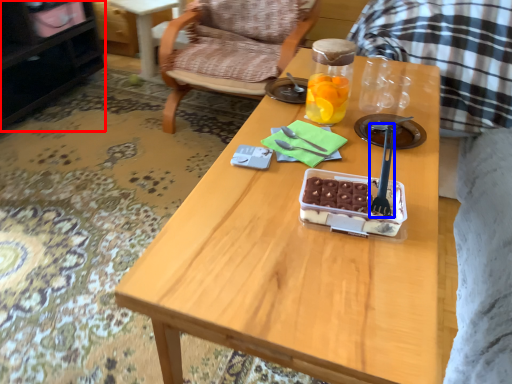
Question: Which of the following is the closest to the observer, cabinetry (highlighted by a red box) or fork (highlighted by a blue box)?

Choices:
 (A) cabinetry
 (B) fork

Answer: (B)